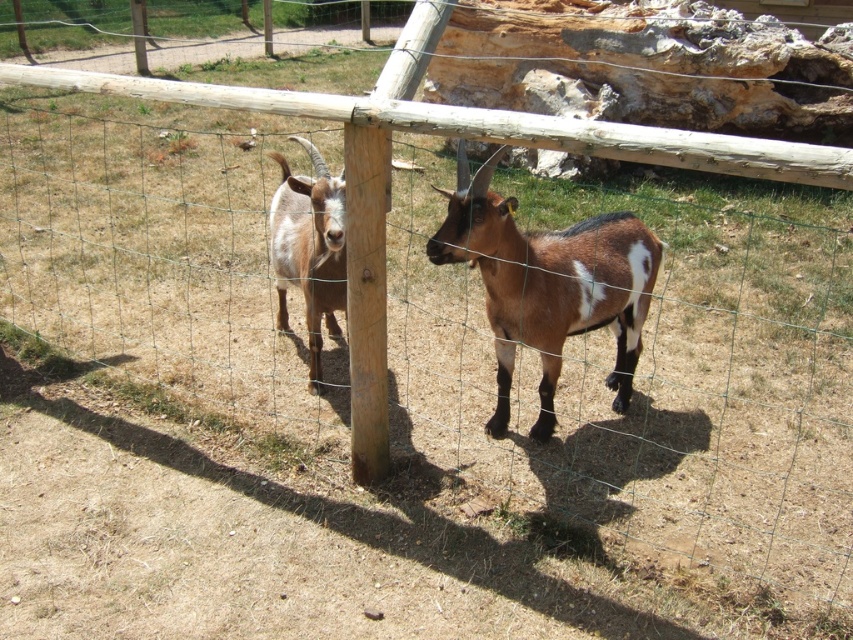
Question: Observing the image, what is the correct spatial positioning of brown fuzzy goat at center in reference to white fur goat at center?

Choices:
 (A) above
 (B) below

Answer: (B)

Question: Observing the image, what is the correct spatial positioning of brown fuzzy goat at center in reference to white fur goat at center?

Choices:
 (A) right
 (B) left

Answer: (A)

Question: Is brown fuzzy goat at center smaller than white fur goat at center?

Choices:
 (A) yes
 (B) no

Answer: (B)